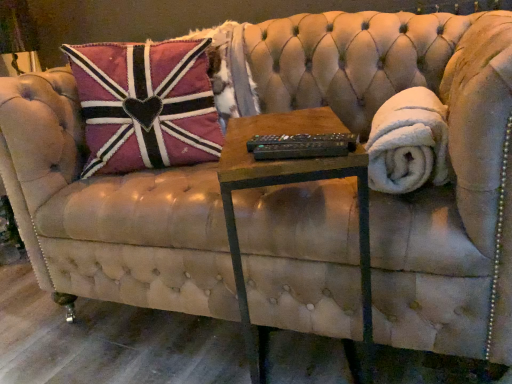
Locate an element on the screen. woodenmaterial/texturetable at center is located at coordinates (292, 183).

This screenshot has width=512, height=384. What do you see at coordinates (292, 183) in the screenshot?
I see `woodenmaterial/texturetable at center` at bounding box center [292, 183].

In order to face white fluffy blanket at right, should I rotate leftwards or rightwards?

Turn right by 18.885 degrees to look at white fluffy blanket at right.

Where is `white fluffy blanket at right`? Image resolution: width=512 pixels, height=384 pixels. white fluffy blanket at right is located at coordinates (408, 143).

This screenshot has height=384, width=512. What do you see at coordinates (408, 143) in the screenshot?
I see `white fluffy blanket at right` at bounding box center [408, 143].

Where is `woodenmaterial/texturetable at center`? The image size is (512, 384). woodenmaterial/texturetable at center is located at coordinates (292, 183).

Considering the positions of objects woodenmaterial/texturetable at center and white fluffy blanket at right in the image provided, who is more to the right, woodenmaterial/texturetable at center or white fluffy blanket at right?

Positioned to the right is white fluffy blanket at right.

Is woodenmaterial/texturetable at center in front of or behind white fluffy blanket at right in the image?

In the image, woodenmaterial/texturetable at center appears in front of white fluffy blanket at right.

Considering the positions of points (366, 264) and (407, 133), is point (366, 264) farther from camera compared to point (407, 133)?

That is True.

From the image's perspective, is woodenmaterial/texturetable at center below white fluffy blanket at right?

Yes.

From a real-world perspective, is woodenmaterial/texturetable at center located higher than white fluffy blanket at right?

No.

Between woodenmaterial/texturetable at center and white fluffy blanket at right, which one has larger width?

woodenmaterial/texturetable at center.

Considering the relative sizes of woodenmaterial/texturetable at center and white fluffy blanket at right in the image provided, is woodenmaterial/texturetable at center taller than white fluffy blanket at right?

Yes, woodenmaterial/texturetable at center is taller than white fluffy blanket at right.

Does woodenmaterial/texturetable at center have a larger size compared to white fluffy blanket at right?

Yes, woodenmaterial/texturetable at center is bigger than white fluffy blanket at right.

Would you say white fluffy blanket at right is part of woodenmaterial/texturetable at center's contents?

That's incorrect, white fluffy blanket at right is not inside woodenmaterial/texturetable at center.

Is the surface of woodenmaterial/texturetable at center in direct contact with white fluffy blanket at right?

No, woodenmaterial/texturetable at center is not with white fluffy blanket at right.

Is white fluffy blanket at right at the back of woodenmaterial/texturetable at center?

Answer: No, woodenmaterial/texturetable at center is not facing the opposite direction of white fluffy blanket at right.

You are a GUI agent. You are given a task and a screenshot of the screen. Output one action in this format:
    pyautogui.click(x=<x>, y=<y>)
    Task: Click on the blanket lying behind the woodenmaterial/texturetable at center
    
    Given the screenshot: What is the action you would take?
    pyautogui.click(x=408, y=143)

Visually, is white fluffy blanket at right positioned to the left or to the right of woodenmaterial/texturetable at center?

In the image, white fluffy blanket at right appears on the right side of woodenmaterial/texturetable at center.

Which is in front, white fluffy blanket at right or woodenmaterial/texturetable at center?

woodenmaterial/texturetable at center is more forward.

Is point (379, 121) closer or farther from the camera than point (244, 131)?

Clearly, point (379, 121) is more distant from the camera than point (244, 131).

From the image's perspective, would you say white fluffy blanket at right is shown under woodenmaterial/texturetable at center?

Actually, white fluffy blanket at right appears above woodenmaterial/texturetable at center in the image.

From a real-world perspective, is white fluffy blanket at right positioned over woodenmaterial/texturetable at center based on gravity?

Yes, from a real-world perspective, white fluffy blanket at right is above woodenmaterial/texturetable at center.

Which object is wider, white fluffy blanket at right or woodenmaterial/texturetable at center?

woodenmaterial/texturetable at center.

Which of these two, white fluffy blanket at right or woodenmaterial/texturetable at center, stands shorter?

Standing shorter between the two is white fluffy blanket at right.

Considering the sizes of objects white fluffy blanket at right and woodenmaterial/texturetable at center in the image provided, who is smaller, white fluffy blanket at right or woodenmaterial/texturetable at center?

With smaller size is white fluffy blanket at right.

Can we say white fluffy blanket at right lies outside woodenmaterial/texturetable at center?

white fluffy blanket at right lies outside woodenmaterial/texturetable at center's area.

Does white fluffy blanket at right touch woodenmaterial/texturetable at center?

No, white fluffy blanket at right is not making contact with woodenmaterial/texturetable at center.

Is white fluffy blanket at right facing towards woodenmaterial/texturetable at center?

No, white fluffy blanket at right is not oriented towards woodenmaterial/texturetable at center.

How many degrees apart are the facing directions of white fluffy blanket at right and woodenmaterial/texturetable at center?

The angle between the facing direction of white fluffy blanket at right and the facing direction of woodenmaterial/texturetable at center is 71.8 degrees.

Find the location of a particular element. The width and height of the screenshot is (512, 384). blanket above the woodenmaterial/texturetable at center (from a real-world perspective) is located at coordinates (408, 143).

Where is `table directly beneath the white fluffy blanket at right (from a real-world perspective)`? table directly beneath the white fluffy blanket at right (from a real-world perspective) is located at coordinates click(x=292, y=183).

Locate an element on the screen. Image resolution: width=512 pixels, height=384 pixels. blanket that is on the right side of woodenmaterial/texturetable at center is located at coordinates (408, 143).